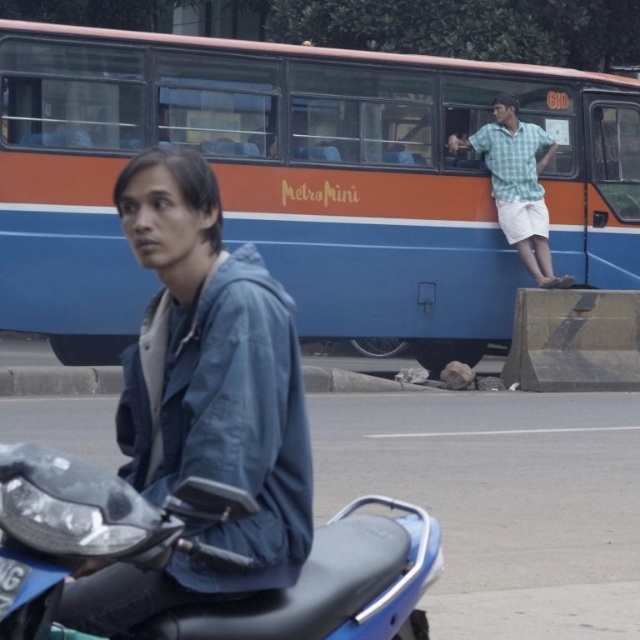
You are a delivery driver who needs to park your van near the blue matte bus at upper center. The parking spot you want is at coordinates point 0.284, 0.470. Can you park your van there?

The blue matte bus at upper center is already positioned at point (300, 180), so the parking spot is occupied and unavailable for your van.

You are standing at the point labeled as point (202, 400) in the image. What object is located at that point?

The point (202, 400) corresponds to the blue matte jacket at center.

You are standing at point (509, 125) and want to walk to point (280, 625). Based on the scene, is the path between them clear of any obstacles?

The path between point (280, 625) and point (509, 125) is clear since the scene describes a street scene with two individuals and a bus but no mention of obstacles blocking the path between the two points.